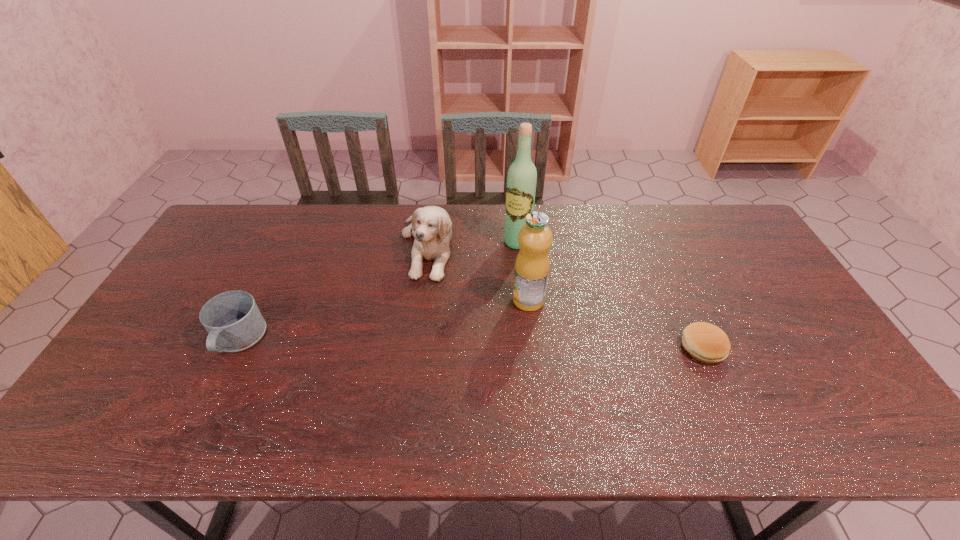
Where is `mug`? The width and height of the screenshot is (960, 540). mug is located at coordinates (232, 319).

Where is `the fourth tallest object`? The height and width of the screenshot is (540, 960). the fourth tallest object is located at coordinates (232, 319).

Where is `the rightmost object`? the rightmost object is located at coordinates (705, 342).

At what (x,y) coordinates should I click in order to perform the action: click on patty. Please return your answer as a coordinate pair (x, y). Image resolution: width=960 pixels, height=540 pixels. Looking at the image, I should click on (705, 342).

You are a GUI agent. You are given a task and a screenshot of the screen. Output one action in this format:
    pyautogui.click(x=<x>, y=<y>)
    Task: Click on the puppy
    The width and height of the screenshot is (960, 540).
    Given the screenshot: What is the action you would take?
    pyautogui.click(x=431, y=226)

This screenshot has width=960, height=540. Find the location of `the third shortest object`. the third shortest object is located at coordinates [431, 226].

At what (x,y) coordinates should I click in order to perform the action: click on the second tallest object. Please return your answer as a coordinate pair (x, y). Looking at the image, I should click on (535, 238).

Find the location of a particular element. The height and width of the screenshot is (540, 960). the third nearest object is located at coordinates (535, 238).

Locate an element on the screen. This screenshot has height=540, width=960. the tallest object is located at coordinates (522, 176).

Locate an element on the screen. This screenshot has height=540, width=960. free space located on the side of the mug with the handle is located at coordinates (216, 386).